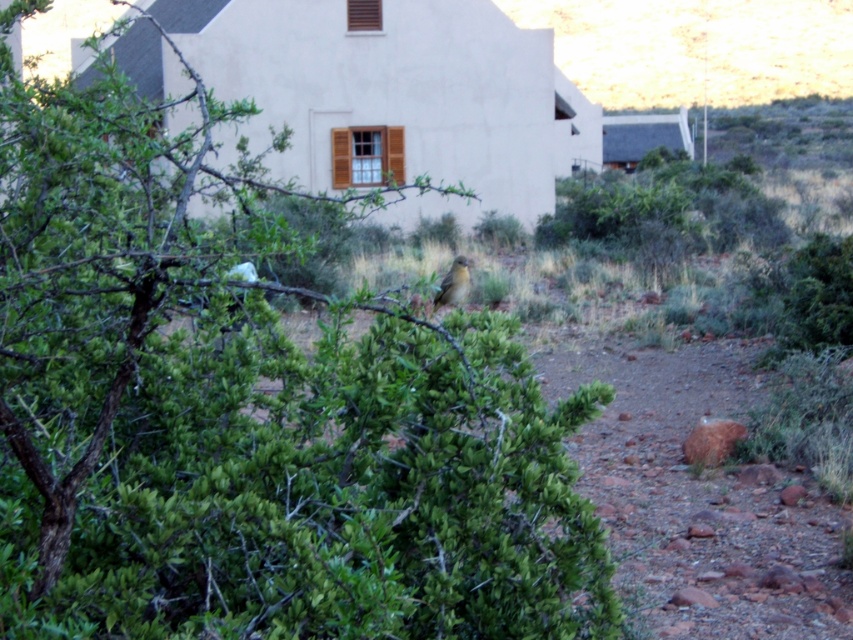
Question: In this image, where is green leafy bush at center located relative to brown feathered bird at center?

Choices:
 (A) below
 (B) above

Answer: (A)

Question: Does green leafy bush at center appear over brown feathered bird at center?

Choices:
 (A) no
 (B) yes

Answer: (A)

Question: Which point is closer to the camera?

Choices:
 (A) green leafy bush at center
 (B) brown feathered bird at center

Answer: (A)

Question: Is green leafy bush at center above brown feathered bird at center?

Choices:
 (A) no
 (B) yes

Answer: (A)

Question: Among these objects, which one is nearest to the camera?

Choices:
 (A) brown feathered bird at center
 (B) green leafy bush at center

Answer: (B)